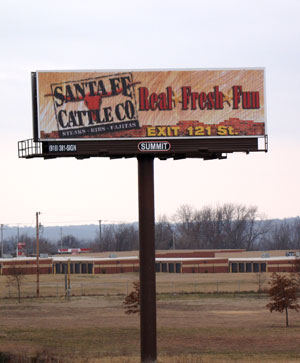
Identify the location of storage unit. (99, 270).